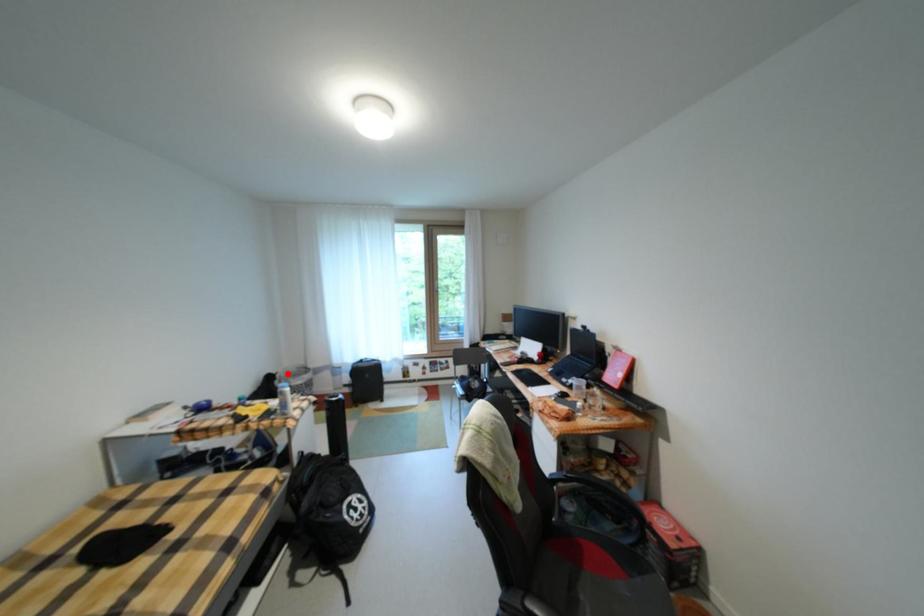
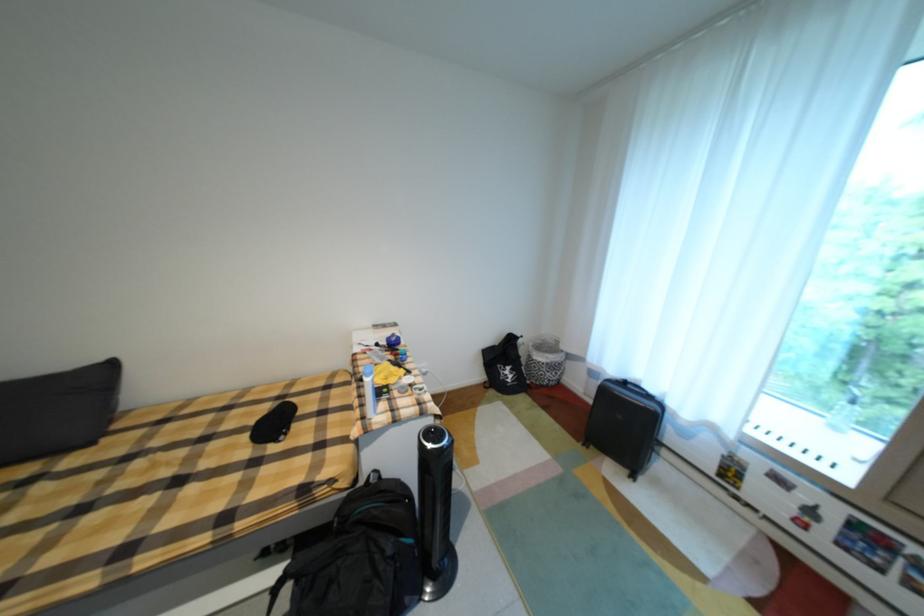
Question: I am providing you with two images of the same scene from different viewpoints. Image1 has a red point marked. In image2, the corresponding 3D location appears at what relative position? Reply with the corresponding letter.

Choices:
 (A) Closer
 (B) Farther

Answer: (B)